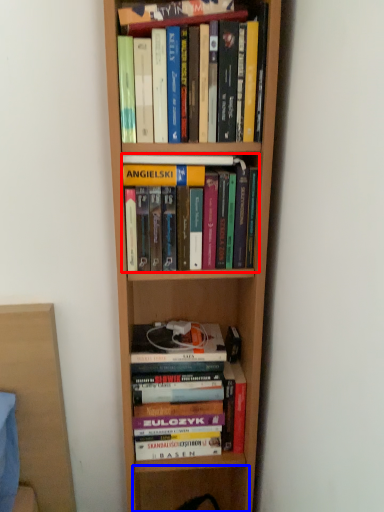
Question: Which object is closer to the camera taking this photo, book (highlighted by a red box) or shelf (highlighted by a blue box)?

Choices:
 (A) book
 (B) shelf

Answer: (A)